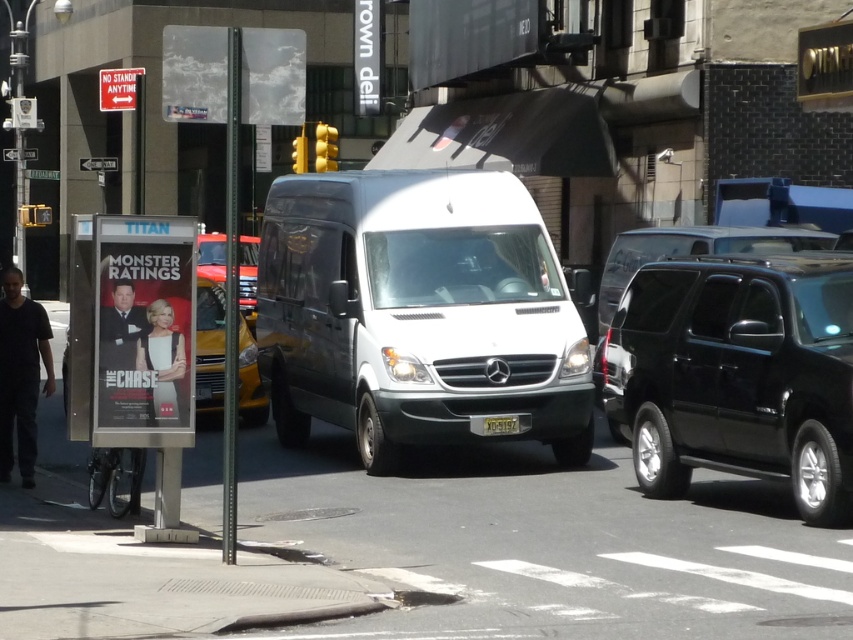
What is the exact position of the white glossy van at center in the image?

The white glossy van at center is located at point (x=416, y=314).

What is the significance of the point at coordinates (416,314) in the image?

The point at coordinates (416,314) marks the location of the white glossy van at center.